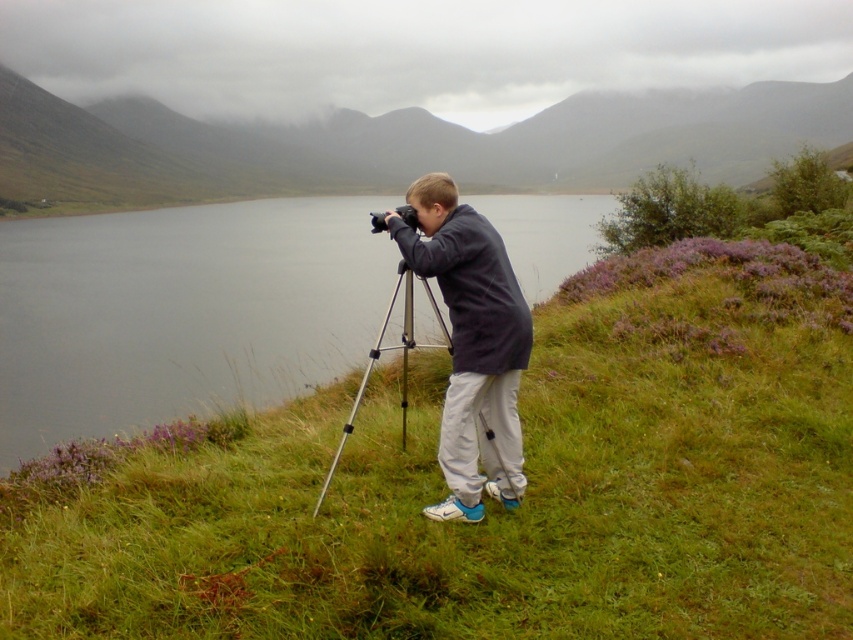
You are a photographer trying to fit both the dark gray jacket at center and the black plastic camera at center into your frame. Which object is wider so you can adjust your camera angle accordingly?

The dark gray jacket at center is wider than the black plastic camera at center, so you should adjust your camera angle to accommodate its width.